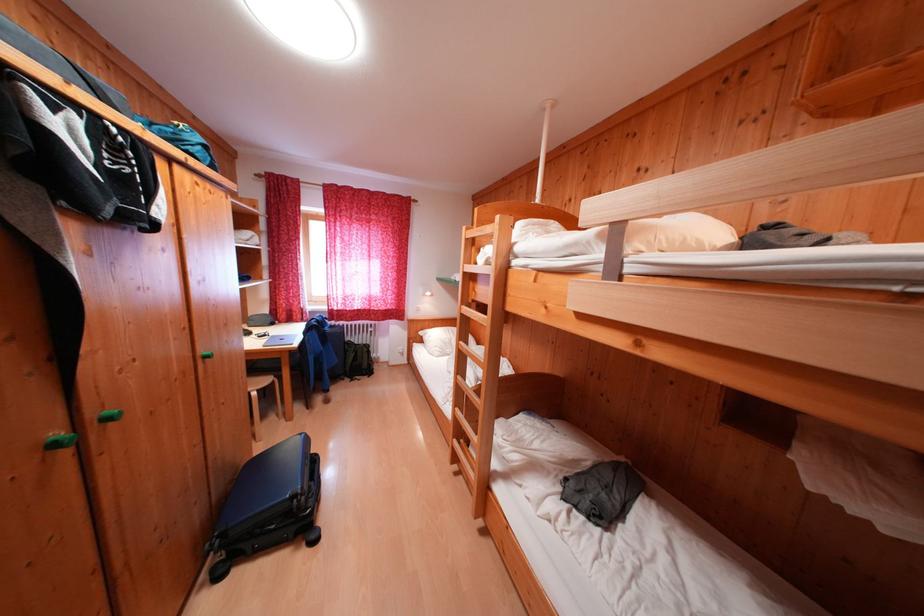
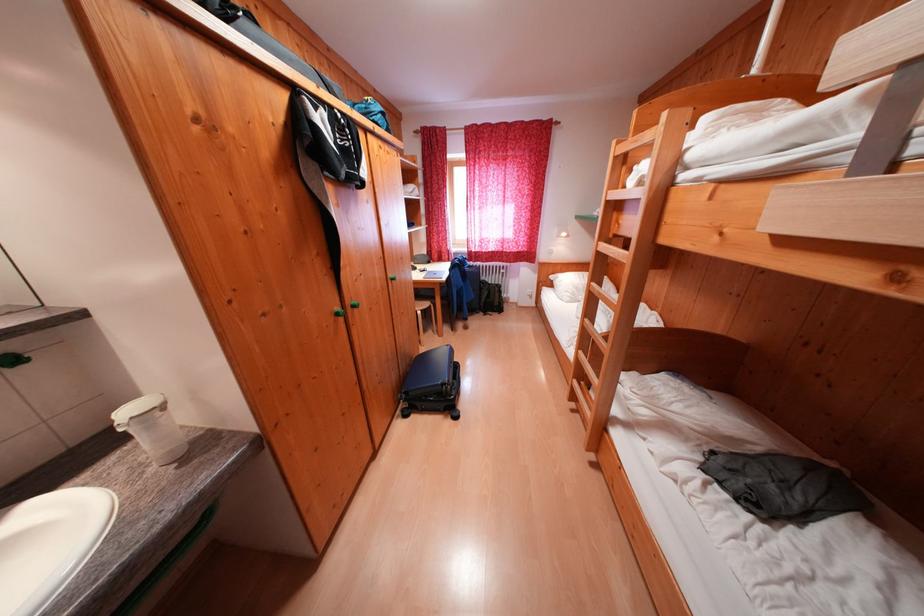
Locate, in the second image, the point that corresponds to point (102, 418) in the first image.

(357, 306)